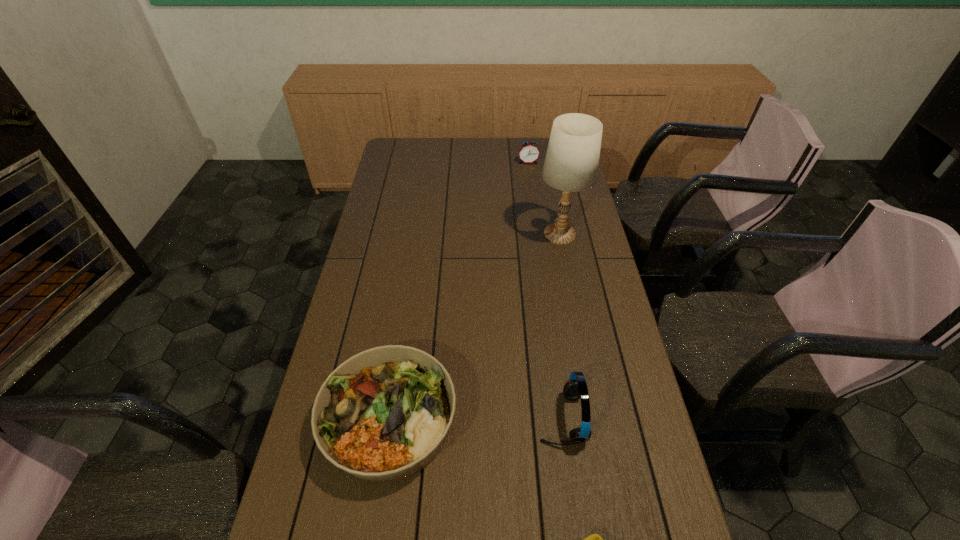
The height and width of the screenshot is (540, 960). I want to click on free point between the farthest object and the salad plate, so click(x=459, y=292).

Locate an element on the screen. Image resolution: width=960 pixels, height=540 pixels. vacant space that's between the alarm clock and the salad plate is located at coordinates (459, 292).

The width and height of the screenshot is (960, 540). Find the location of `vacant area that lies between the tallest object and the second tallest object`. vacant area that lies between the tallest object and the second tallest object is located at coordinates (561, 326).

Find the location of `free space between the salad plate and the lamp`. free space between the salad plate and the lamp is located at coordinates (475, 327).

This screenshot has height=540, width=960. In order to click on empty space that is in between the second farthest object and the leftmost object in this screenshot , I will do `click(475, 327)`.

Where is `blank region between the salad plate and the second tallest object`? The image size is (960, 540). blank region between the salad plate and the second tallest object is located at coordinates (476, 420).

This screenshot has height=540, width=960. Find the location of `free point between the farthest object and the tallest object`. free point between the farthest object and the tallest object is located at coordinates (544, 198).

Identify the location of object that is the fourth nearest to the salad plate. [x=529, y=152].

Find the location of a particular element. This screenshot has width=960, height=540. object that is the third closest to the farthest object is located at coordinates (575, 388).

This screenshot has height=540, width=960. What are the coordinates of `blank space that satisfies the following two spatial constraints: 1. on the clock face of the alarm clock; 2. with the microphone attached to the side of the headset` in the screenshot? It's located at (564, 418).